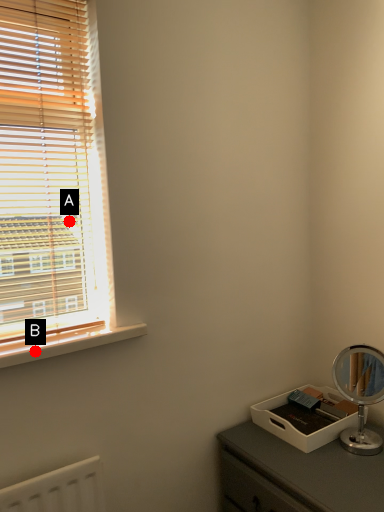
Question: Two points are circled on the image, labeled by A and B beside each circle. Which point is further to the camera?

Choices:
 (A) A is further
 (B) B is further

Answer: (A)